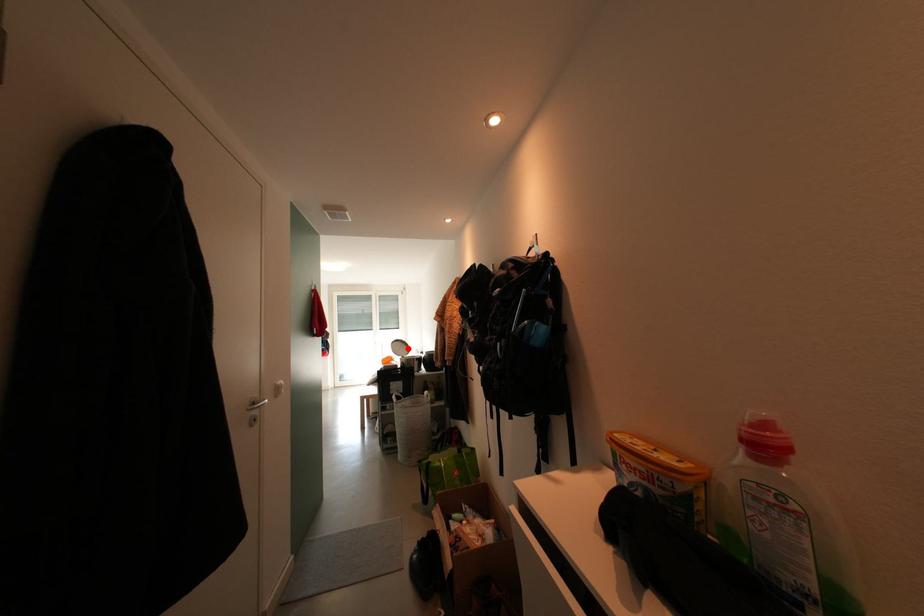
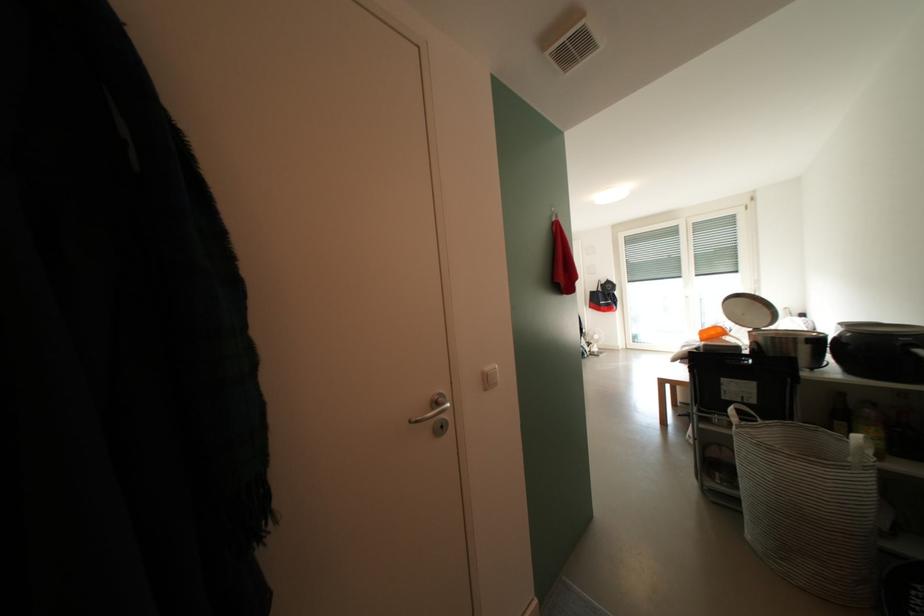
The point at the highlighted location is marked in the first image. Where is the corresponding point in the second image?

(756, 308)